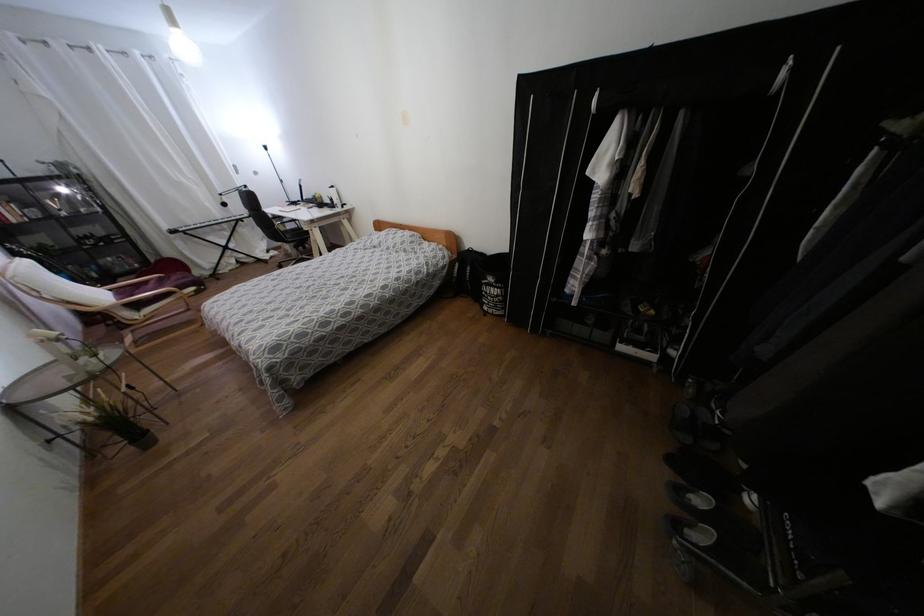
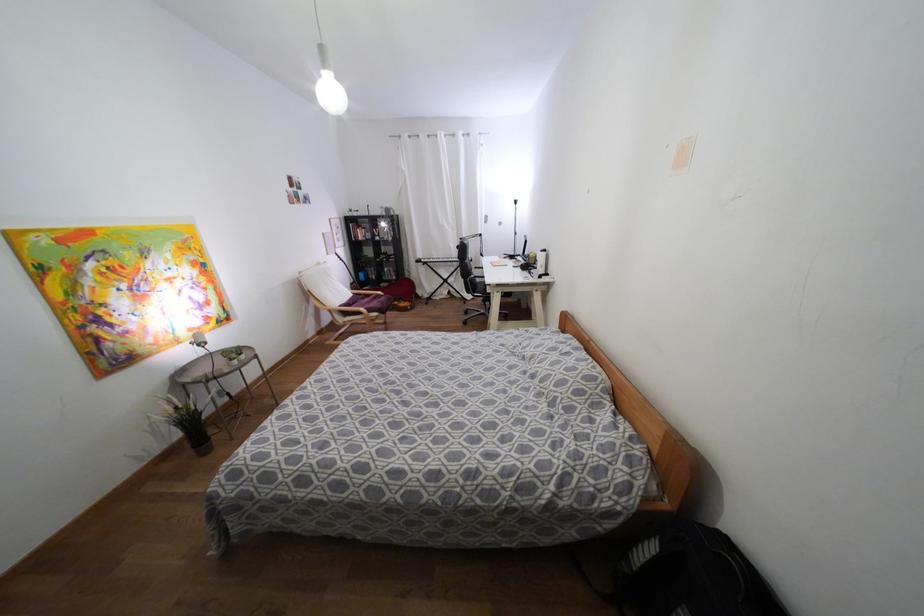
Where in the second image is the point corresponding to (175,277) from the first image?

(382, 299)